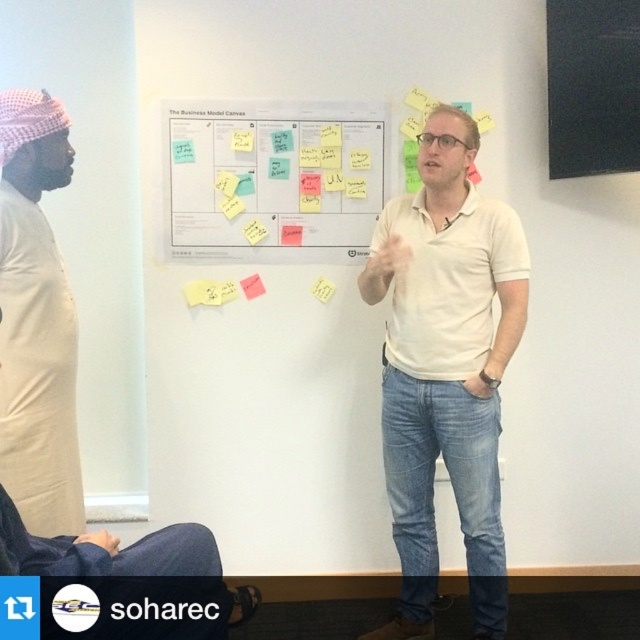
You are an attendee in the meeting room. You need to place a new red sticky note on the board that is closer to you. Which board should you choose between the black matte board at upper right and the yellow sticky note at upper center?

The black matte board at upper right is closer to the viewer than the yellow sticky note at upper center, so you should place the new red sticky note on the black matte board at upper right.

You are an attendee in the meeting room. You need to locate both the black matte board at upper right and the yellow sticky note at upper center. Which one is positioned higher in the image?

The black matte board at upper right is positioned higher than the yellow sticky note at upper center.